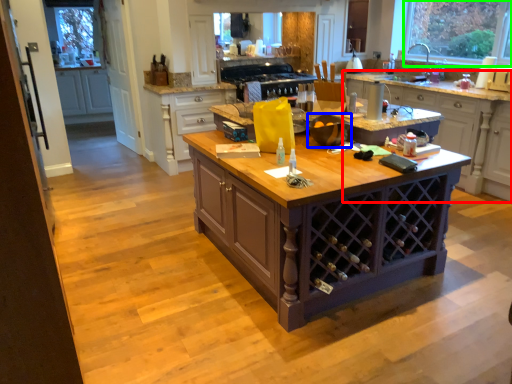
Question: Which is nearer to the cabinetry (highlighted by a red box)? appliance (highlighted by a blue box) or window (highlighted by a green box).

Choices:
 (A) appliance
 (B) window

Answer: (B)